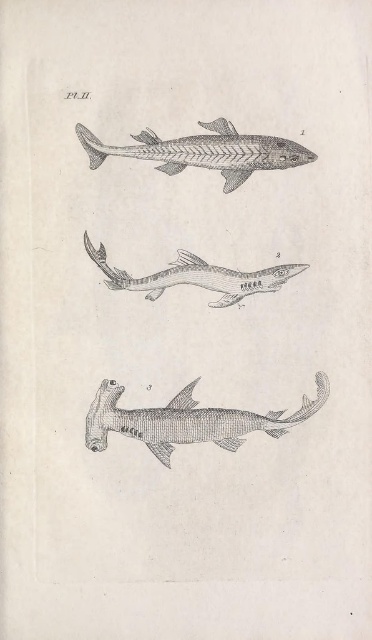
Question: Can you confirm if gray textured hammerhead shark at bottom is positioned to the left of gray textured shark at center?

Choices:
 (A) no
 (B) yes

Answer: (A)

Question: Observing the image, what is the correct spatial positioning of gray textured hammerhead shark at bottom in reference to gray textured shark at center?

Choices:
 (A) below
 (B) above

Answer: (A)

Question: Which point appears closest to the camera in this image?

Choices:
 (A) (207, 284)
 (B) (232, 161)

Answer: (B)

Question: Can you confirm if gray textured hammerhead shark at bottom is positioned to the left of gray textured shark at center?

Choices:
 (A) no
 (B) yes

Answer: (A)

Question: Which of these objects is positioned closest to the gray textured shark at upper center?

Choices:
 (A) gray textured hammerhead shark at bottom
 (B) gray textured shark at center

Answer: (B)

Question: Which object is the farthest from the gray textured shark at upper center?

Choices:
 (A) gray textured hammerhead shark at bottom
 (B) gray textured shark at center

Answer: (A)